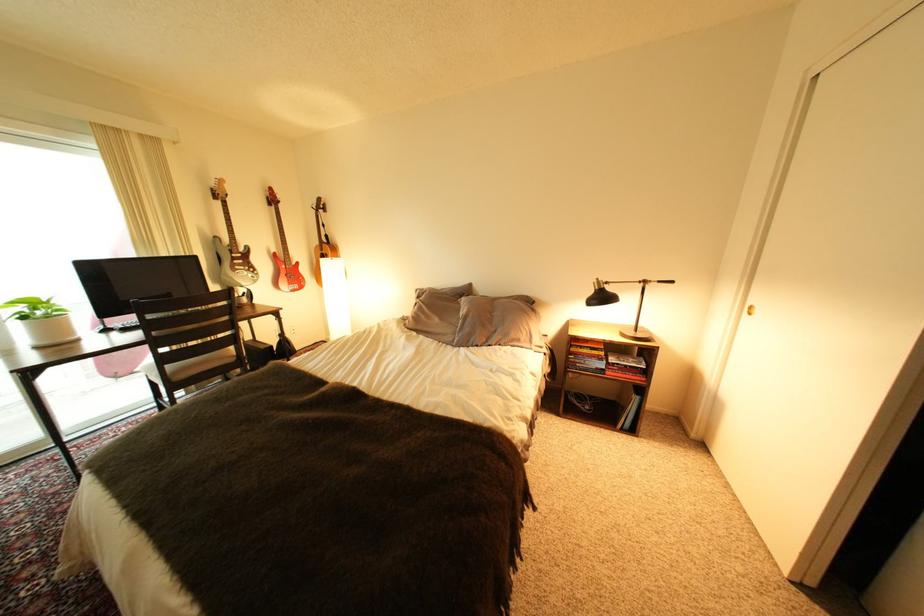
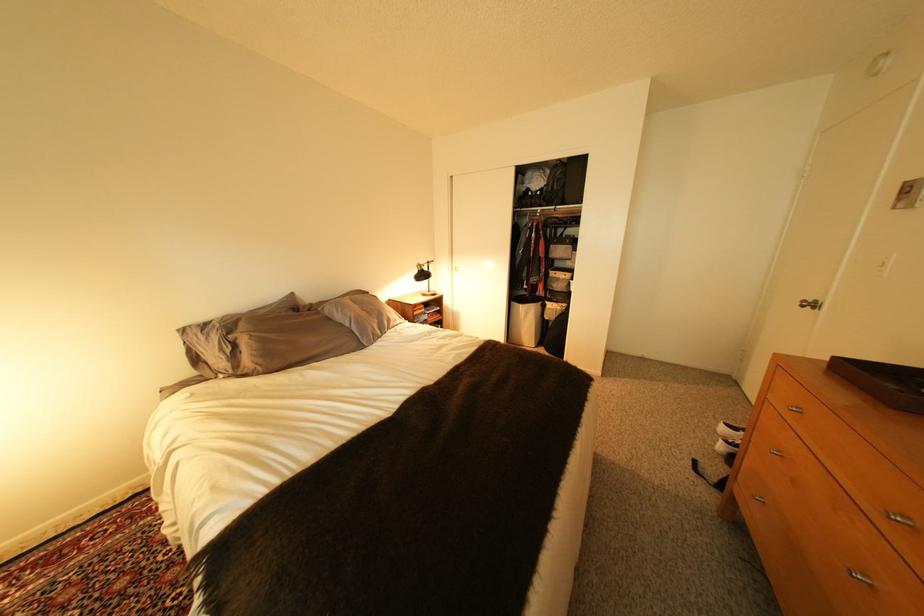
The point at (x=473, y=302) is marked in the first image. Where is the corresponding point in the second image?

(335, 310)